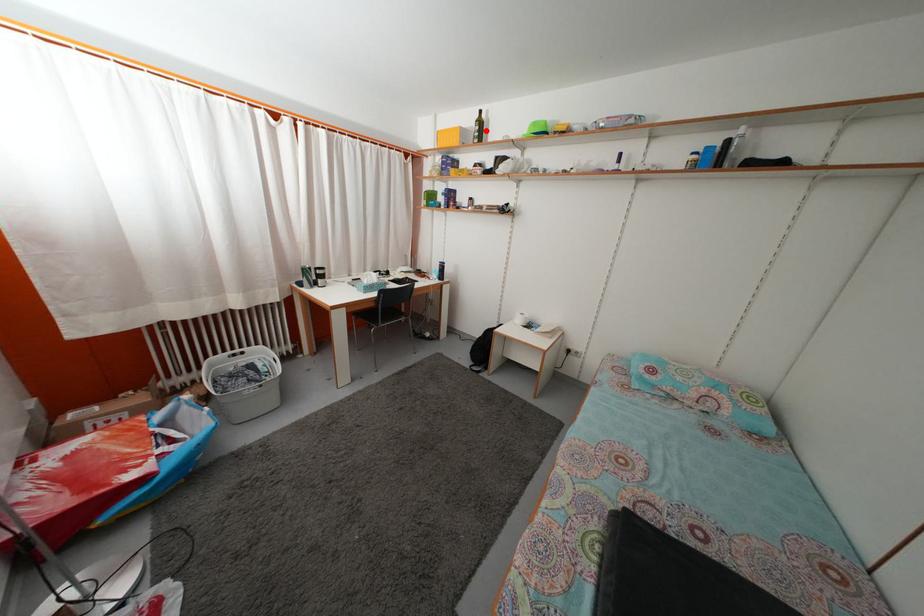
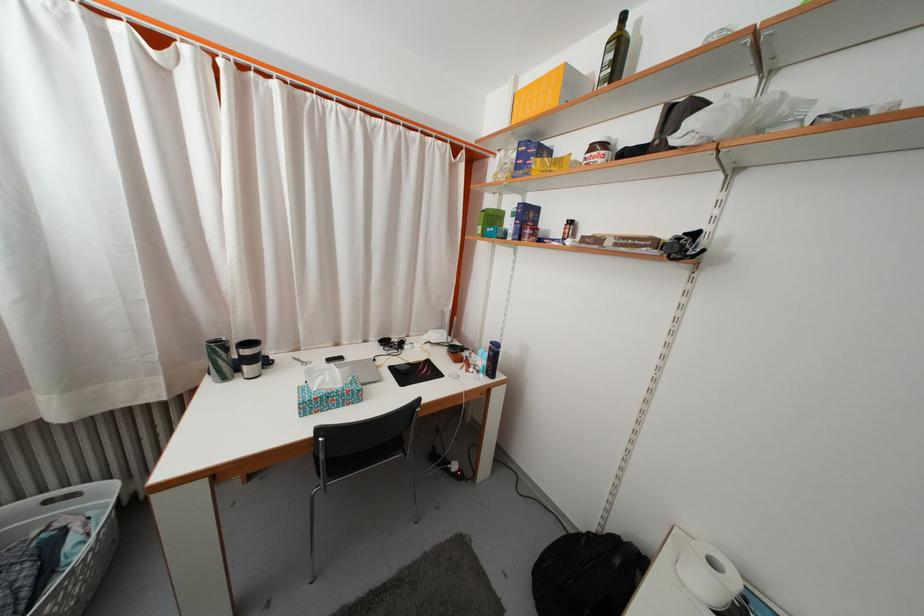
In the second image, find the point that corresponds to the highlighted location in the first image.

(625, 54)